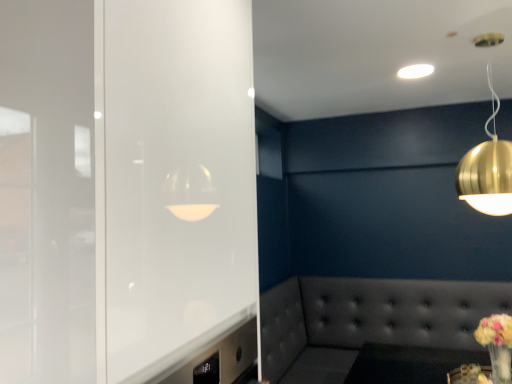
Question: Is white glossy ceiling light at upper center, positioned as the second lamp in front-to-back order, aimed at pastel yellow bouquet at lower right?

Choices:
 (A) no
 (B) yes

Answer: (A)

Question: Is there a large distance between white glossy ceiling light at upper center, the first lamp when ordered from top to bottom, and pastel yellow bouquet at lower right?

Choices:
 (A) no
 (B) yes

Answer: (B)

Question: Is white glossy ceiling light at upper center, positioned as the second lamp in front-to-back order, wider than pastel yellow bouquet at lower right?

Choices:
 (A) yes
 (B) no

Answer: (A)

Question: From the image's perspective, is white glossy ceiling light at upper center, the first lamp when ordered from top to bottom, beneath pastel yellow bouquet at lower right?

Choices:
 (A) yes
 (B) no

Answer: (B)

Question: Considering the relative positions of white glossy ceiling light at upper center, arranged as the first lamp when viewed from the back, and pastel yellow bouquet at lower right in the image provided, is white glossy ceiling light at upper center, arranged as the first lamp when viewed from the back, to the left of pastel yellow bouquet at lower right from the viewer's perspective?

Choices:
 (A) no
 (B) yes

Answer: (B)

Question: From a real-world perspective, is white glossy ceiling light at upper center, positioned as the second lamp in front-to-back order, over pastel yellow bouquet at lower right?

Choices:
 (A) yes
 (B) no

Answer: (A)

Question: Is pastel yellow bouquet at lower right directly adjacent to tufted leather couch at lower right?

Choices:
 (A) yes
 (B) no

Answer: (B)

Question: Considering the relative sizes of pastel yellow bouquet at lower right and tufted leather couch at lower right in the image provided, is pastel yellow bouquet at lower right taller than tufted leather couch at lower right?

Choices:
 (A) yes
 (B) no

Answer: (B)

Question: Considering the relative sizes of pastel yellow bouquet at lower right and tufted leather couch at lower right in the image provided, is pastel yellow bouquet at lower right thinner than tufted leather couch at lower right?

Choices:
 (A) yes
 (B) no

Answer: (A)

Question: From the image's perspective, is pastel yellow bouquet at lower right over tufted leather couch at lower right?

Choices:
 (A) yes
 (B) no

Answer: (A)

Question: From a real-world perspective, is pastel yellow bouquet at lower right located beneath tufted leather couch at lower right?

Choices:
 (A) no
 (B) yes

Answer: (A)

Question: From the image's perspective, would you say pastel yellow bouquet at lower right is shown under tufted leather couch at lower right?

Choices:
 (A) yes
 (B) no

Answer: (B)

Question: Could you tell me if gold metallic sphere at upper right, placed as the second lamp when sorted from back to front, is turned towards pastel yellow bouquet at lower right?

Choices:
 (A) no
 (B) yes

Answer: (A)